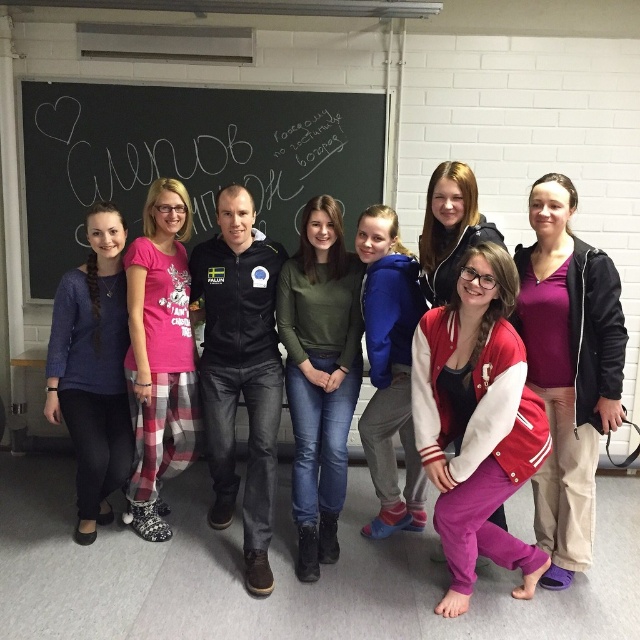
Question: Can you confirm if black chalkboard at upper left is thinner than green matte sweater at center?

Choices:
 (A) no
 (B) yes

Answer: (A)

Question: Among these points, which one is farthest from the camera?

Choices:
 (A) (524, 333)
 (B) (148, 355)
 (C) (445, 467)
 (D) (241, 390)

Answer: (D)

Question: Where is black chalkboard at upper left located in relation to purple soft sweater at center in the image?

Choices:
 (A) below
 (B) above

Answer: (B)

Question: Does vivid red velour jacket at center appear on the right side of black matte jacket at center?

Choices:
 (A) yes
 (B) no

Answer: (A)

Question: Which object is the farthest from the vivid red velour jacket at center?

Choices:
 (A) knitted blue sweater at left
 (B) blue fleece jacket at center
 (C) matte black jacket at center
 (D) pink cotton pajama pants at center

Answer: (A)

Question: Estimate the real-world distances between objects in this image. Which object is farther from the black chalkboard at upper left?

Choices:
 (A) green matte sweater at center
 (B) purple soft sweater at center

Answer: (B)